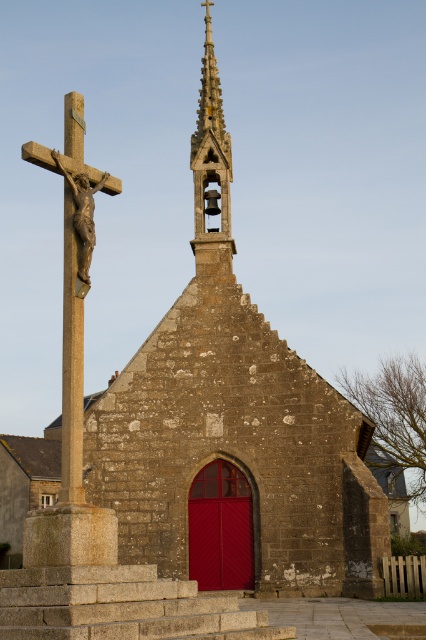
Looking at this image, you are an architect designing a new garden layout around the chapel. The garden will have a central fountain. To ensure the fountain is placed directly in front of the smooth stone spire at upper center, what are the coordinates of the spire that you should reference?

The smooth stone spire at upper center is located at coordinates point (210, 170), so you should reference these coordinates to place the fountain directly in front of it.

You are standing at the entrance of the smooth stone spire at upper center and want to place a new decoration on the polished bronze crucifix at left. Which direction should you move to reach the crucifix?

The smooth stone spire at upper center is positioned over the polished bronze crucifix at left, so you should move downward and to the left to reach the crucifix.

You are standing in front of the chapel and want to place a new flowerpot between the smooth stone spire at upper center and the polished bronze crucifix at left. Can you determine which side of the flowerpot should face the chapel?

The smooth stone spire at upper center is to the right of the polished bronze crucifix at left, so the flowerpot should be placed between them with its right side facing the chapel.